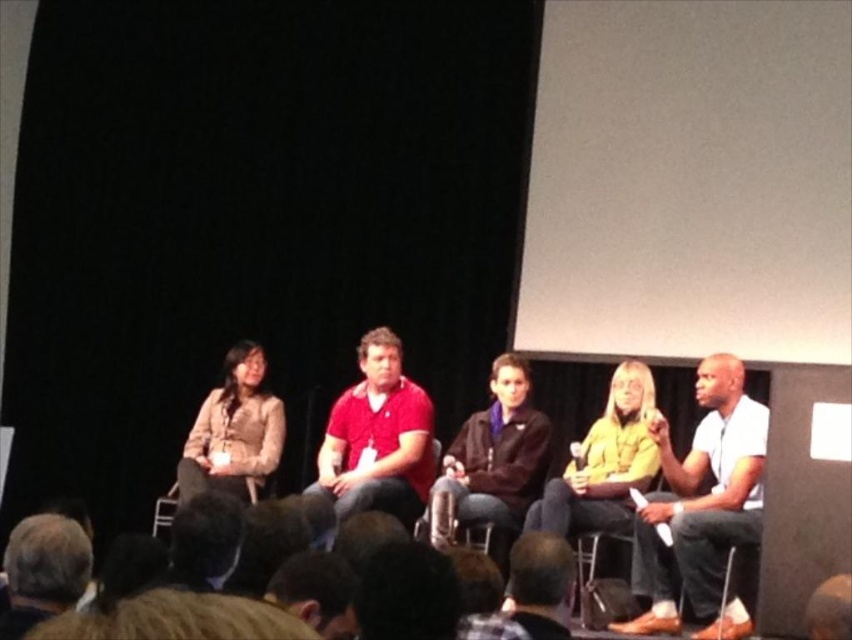
You are an event organizer standing at the back of the room. You need to pass a note to the brown hair at lower left and the white matte shirt at right. Which one can you reach without walking closer to the stage?

The brown hair at lower left is closer to you than the white matte shirt at right, so you can reach the brown hair at lower left without walking closer.